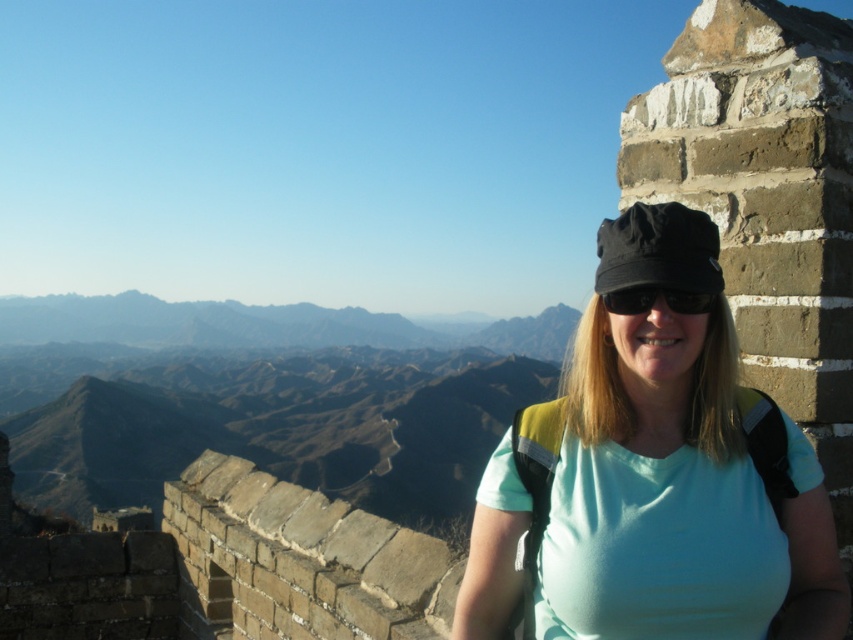
You are a drone operator tasked with capturing aerial footage of the Great Wall. You need to fly your drone from point A to point B. Point A is at coordinates point (611, 604) and point B is at coordinates point (611, 310). Given that the drone must fly directly towards the camera to avoid obstacles, will the drone be able to fly from point A to point B without deviating its path?

Point (611, 604) is in front of point (611, 310). Since the drone must fly directly towards the camera, it cannot fly from point A to point B without deviating because point B is behind point A from the camera perspective.

You are a photographer trying to capture the person on the Great Wall. You notice a point at coordinates [674,467] in the image. What object is located at this point?

The point at coordinates [674,467] corresponds to the matte black cap at upper right.

You are taking a photo of the person on the Great Wall and want to ensure both the matte black cap at upper right and the black matte sunglasses at center are clearly visible. Which object should be moved to the right to avoid overlapping?

The matte black cap at upper right should be moved to the right since it is currently on the left side of the black matte sunglasses at center, causing potential overlap.